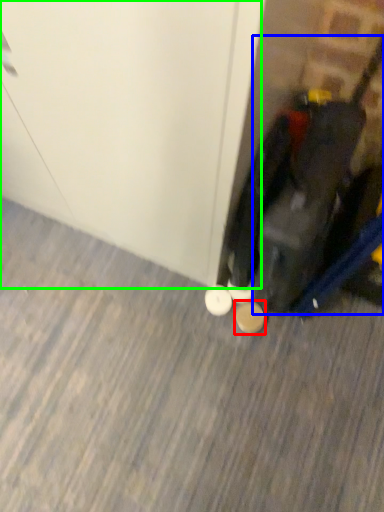
Question: Based on their relative distances, which object is nearer to footwear (highlighted by a red box)? Choose from luggage (highlighted by a blue box) and door (highlighted by a green box).

Choices:
 (A) luggage
 (B) door

Answer: (A)